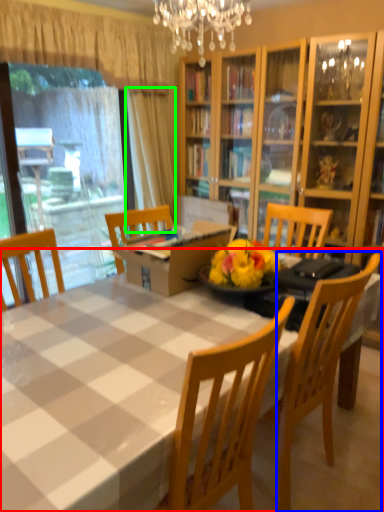
Question: Which object is the closest to the kitchen & dining room table (highlighted by a red box)? Choose among these: chair (highlighted by a blue box) or curtain (highlighted by a green box).

Choices:
 (A) chair
 (B) curtain

Answer: (A)